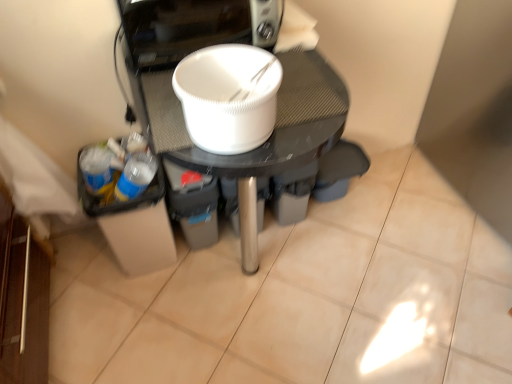
Question: Is point (219, 102) positioned closer to the camera than point (295, 104)?

Choices:
 (A) farther
 (B) closer

Answer: (B)

Question: From the image's perspective, relative to white matte bowl at center, is white matte bowl at center above or below?

Choices:
 (A) below
 (B) above

Answer: (B)

Question: Looking at the image, does white matte bowl at center seem bigger or smaller compared to white matte bowl at center?

Choices:
 (A) big
 (B) small

Answer: (B)

Question: Is white matte bowl at center wider or thinner than white matte bowl at center?

Choices:
 (A) wide
 (B) thin

Answer: (A)

Question: Is point (200, 39) closer or farther from the camera than point (254, 51)?

Choices:
 (A) closer
 (B) farther

Answer: (B)

Question: Considering the relative positions of white matte bowl at center and white matte bowl at center in the image provided, is white matte bowl at center to the left or to the right of white matte bowl at center?

Choices:
 (A) right
 (B) left

Answer: (B)

Question: Is white matte bowl at center spatially inside white matte bowl at center, or outside of it?

Choices:
 (A) inside
 (B) outside

Answer: (B)